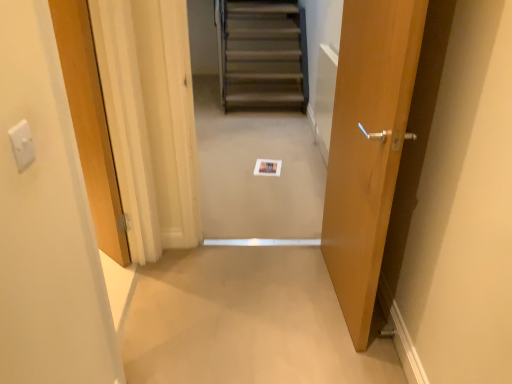
Question: Is the position of wooden door at center, marked as the 2th door in a right-to-left arrangement, less distant than that of matte wood door at right, which is the 2th door in left-to-right order?

Choices:
 (A) yes
 (B) no

Answer: (A)

Question: Is wooden door at center, marked as the 2th door in a right-to-left arrangement, smaller than matte wood door at right, the 1th door in the right-to-left sequence?

Choices:
 (A) no
 (B) yes

Answer: (A)

Question: Could you tell me if wooden door at center, which ranks as the first door in left-to-right order, is turned towards matte wood door at right, the 1th door in the right-to-left sequence?

Choices:
 (A) yes
 (B) no

Answer: (A)

Question: Is wooden door at center, marked as the 2th door in a right-to-left arrangement, positioned far away from matte wood door at right, the 1th door in the right-to-left sequence?

Choices:
 (A) yes
 (B) no

Answer: (A)

Question: Does wooden door at center, which ranks as the first door in left-to-right order, appear on the right side of matte wood door at right, which is the 2th door in left-to-right order?

Choices:
 (A) yes
 (B) no

Answer: (B)

Question: Is matte wood door at right, which is the 2th door in left-to-right order, at the back of wooden door at center, marked as the 2th door in a right-to-left arrangement?

Choices:
 (A) no
 (B) yes

Answer: (B)

Question: Is white plastic electric outlet at upper left in front of beige carpet at center?

Choices:
 (A) yes
 (B) no

Answer: (A)

Question: Can you confirm if white plastic electric outlet at upper left is shorter than beige carpet at center?

Choices:
 (A) no
 (B) yes

Answer: (A)

Question: From the image's perspective, does white plastic electric outlet at upper left appear lower than beige carpet at center?

Choices:
 (A) no
 (B) yes

Answer: (A)

Question: Is white plastic electric outlet at upper left turned away from beige carpet at center?

Choices:
 (A) yes
 (B) no

Answer: (B)

Question: Are white plastic electric outlet at upper left and beige carpet at center beside each other?

Choices:
 (A) no
 (B) yes

Answer: (A)

Question: Can you confirm if white plastic electric outlet at upper left is wider than beige carpet at center?

Choices:
 (A) no
 (B) yes

Answer: (A)

Question: From a real-world perspective, is matte wood door at right, which is the 2th door in left-to-right order, over wooden stairs at center?

Choices:
 (A) yes
 (B) no

Answer: (A)